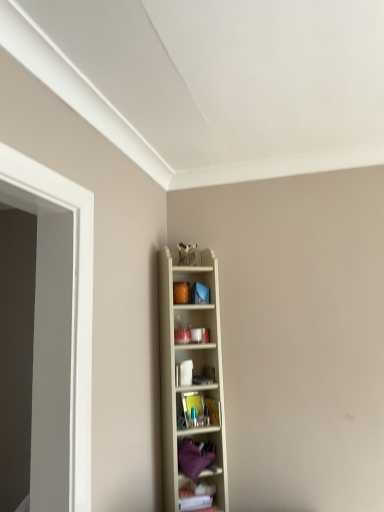
Question: Looking at the image, does white plastic shelf at lower right, which is the 1th shelf in bottom-to-top order, seem bigger or smaller compared to purple fabric at center, which appears as the 2th shelf when viewed from the top?

Choices:
 (A) small
 (B) big

Answer: (A)

Question: Considering the positions of white plastic shelf at lower right, the 3th shelf positioned from the top, and purple fabric at center, which appears as the 2th shelf when viewed from the top, in the image, is white plastic shelf at lower right, the 3th shelf positioned from the top, taller or shorter than purple fabric at center, which appears as the 2th shelf when viewed from the top,?

Choices:
 (A) tall
 (B) short

Answer: (B)

Question: Which is nearer to the wooden shelf at center, positioned as the first shelf in top-to-bottom order?

Choices:
 (A) white plastic shelf at lower right, which is the 1th shelf in bottom-to-top order
 (B) purple fabric at center, which appears as the 2th shelf when viewed from the top

Answer: (B)

Question: Which object is positioned farthest from the wooden shelf at center, positioned as the first shelf in top-to-bottom order?

Choices:
 (A) purple fabric at center, marked as the second shelf in a bottom-to-top arrangement
 (B) white plastic shelf at lower right, the 3th shelf positioned from the top

Answer: (B)